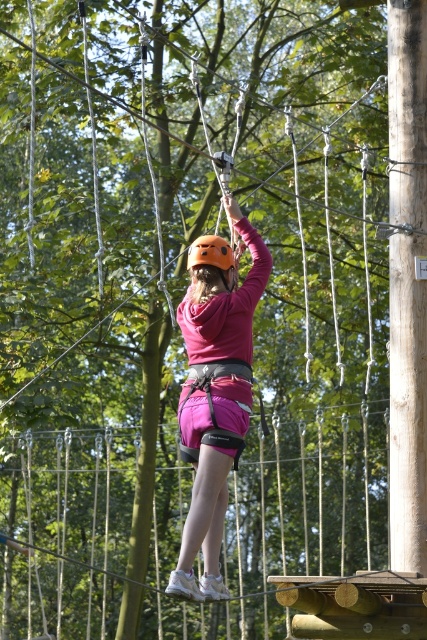
Based on the photo, is pink matte shorts at center closer to the viewer compared to orange matte helmet at center?

That is True.

Is pink matte shorts at center thinner than orange matte helmet at center?

No, pink matte shorts at center is not thinner than orange matte helmet at center.

Is point (213, 284) positioned behind point (219, 272)?

That is True.

Locate an element on the screen. The image size is (427, 640). pink matte shorts at center is located at coordinates (215, 392).

Can you confirm if smooth brown wooden pole at right is positioned below pink matte shorts at center?

Incorrect, smooth brown wooden pole at right is not positioned below pink matte shorts at center.

The height and width of the screenshot is (640, 427). Find the location of `smooth brown wooden pole at right`. smooth brown wooden pole at right is located at coordinates (408, 282).

The image size is (427, 640). Identify the location of smooth brown wooden pole at right. (408, 282).

Where is `smooth brown wooden pole at right`? smooth brown wooden pole at right is located at coordinates (408, 282).

Can you confirm if smooth brown wooden pole at right is bigger than orange matte helmet at center?

Yes.

What do you see at coordinates (408, 282) in the screenshot?
I see `smooth brown wooden pole at right` at bounding box center [408, 282].

What are the coordinates of `smooth brown wooden pole at right` in the screenshot? It's located at (408, 282).